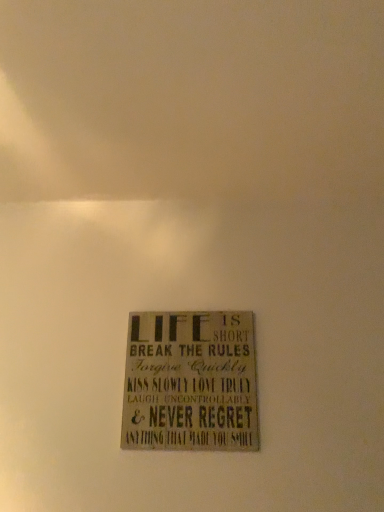
This screenshot has width=384, height=512. What do you see at coordinates (190, 382) in the screenshot? I see `wooden signboard at center` at bounding box center [190, 382].

Image resolution: width=384 pixels, height=512 pixels. Find the location of `wooden signboard at center`. wooden signboard at center is located at coordinates (190, 382).

Measure the distance between wooden signboard at center and camera.

They are 36.34 inches apart.

Image resolution: width=384 pixels, height=512 pixels. I want to click on wooden signboard at center, so click(x=190, y=382).